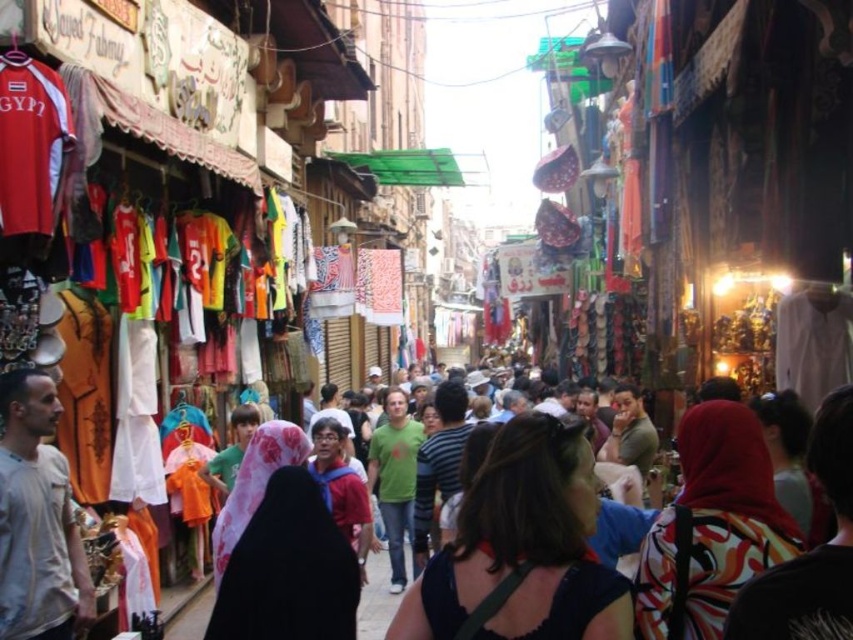
Question: Can you confirm if dark brown hair at center is positioned below printed silk scarf at center?

Choices:
 (A) no
 (B) yes

Answer: (B)

Question: Is printed silk scarf at center further to the viewer compared to printed fabric headscarf at center?

Choices:
 (A) no
 (B) yes

Answer: (B)

Question: Which point appears farthest from the camera in this image?

Choices:
 (A) (410, 428)
 (B) (848, 586)
 (C) (585, 614)
 (D) (714, 612)

Answer: (A)

Question: Is dark brown hair at center in front of printed fabric headscarf at center?

Choices:
 (A) yes
 (B) no

Answer: (B)

Question: Estimate the real-world distances between objects in this image. Which object is closer to the printed fabric headscarf at center?

Choices:
 (A) dark brown hair at center
 (B) green matte shirt at center
 (C) printed silk scarf at center

Answer: (C)

Question: Which object is closer to the camera taking this photo?

Choices:
 (A) dark brown hair at center
 (B) green matte shirt at center

Answer: (A)